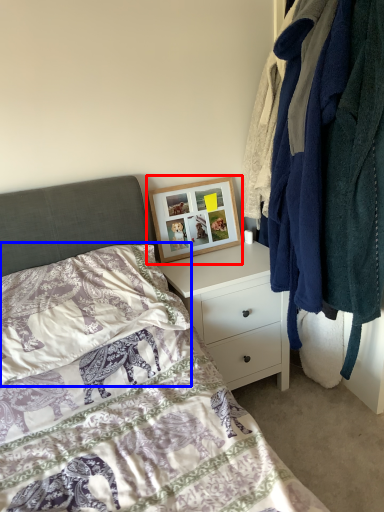
Question: Which object is further to the camera taking this photo, picture frame (highlighted by a red box) or pillow (highlighted by a blue box)?

Choices:
 (A) picture frame
 (B) pillow

Answer: (A)